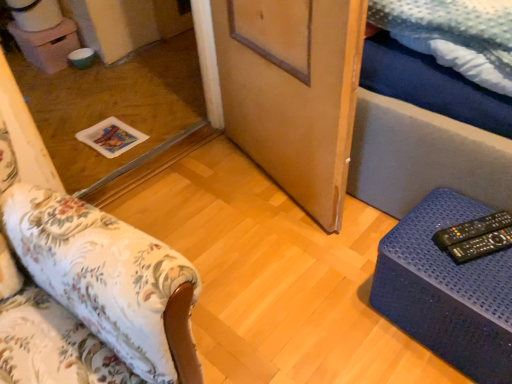
I want to click on floral fabric ottoman at lower left, the 2th furniture in the right-to-left sequence, so click(106, 281).

Locate an element on the screen. The width and height of the screenshot is (512, 384). wooden door at center is located at coordinates (293, 92).

Describe the element at coordinates (480, 246) in the screenshot. The image size is (512, 384). I see `black plastic remote at lower right, the 2th remote viewed from the back` at that location.

Identify the location of black plastic remote at lower right, which is the 1th remote in front-to-back order. (480, 246).

Find the location of a particular element. floral fabric ottoman at lower left, the 2th furniture in the right-to-left sequence is located at coordinates (106, 281).

Between black plastic remote at lower right, the 2th remote viewed from the back, and floral fabric ottoman at lower left, the 2th furniture in the right-to-left sequence, which one has smaller size?

With smaller size is black plastic remote at lower right, the 2th remote viewed from the back.

Considering the positions of objects black plastic remote at lower right, which is the 1th remote in front-to-back order, and floral fabric ottoman at lower left, which is counted as the first furniture, starting from the left, in the image provided, who is more to the right, black plastic remote at lower right, which is the 1th remote in front-to-back order, or floral fabric ottoman at lower left, which is counted as the first furniture, starting from the left,?

black plastic remote at lower right, which is the 1th remote in front-to-back order.

I want to click on the 2nd remote counting from the right side of the floral fabric ottoman at lower left, the 2th furniture in the right-to-left sequence, so click(x=480, y=246).

In the scene shown: From a real-world perspective, who is located lower, black plastic remote at lower right, the 2th remote viewed from the back, or floral fabric ottoman at lower left, the 2th furniture in the right-to-left sequence?

From a 3D spatial view, black plastic remote at lower right, the 2th remote viewed from the back, is below.

Is transparent glass door at center positioned with its back to wooden door at center?

A: transparent glass door at center does not have its back to wooden door at center.

Considering the relative sizes of transparent glass door at center and wooden door at center in the image provided, is transparent glass door at center shorter than wooden door at center?

Yes, transparent glass door at center is shorter than wooden door at center.

Looking at their sizes, would you say transparent glass door at center is wider or thinner than wooden door at center?

In the image, transparent glass door at center appears to be wider than wooden door at center.

From a real-world perspective, between transparent glass door at center and wooden door at center, who is vertically higher?

wooden door at center is physically above.

Considering the sizes of objects transparent glass door at center and blue textured ottoman at lower right, the first furniture in the right-to-left sequence, in the image provided, who is wider, transparent glass door at center or blue textured ottoman at lower right, the first furniture in the right-to-left sequence,?

transparent glass door at center.

Looking at this image, considering the relative positions of transparent glass door at center and blue textured ottoman at lower right, which is counted as the second furniture, starting from the left, in the image provided, is transparent glass door at center to the right of blue textured ottoman at lower right, which is counted as the second furniture, starting from the left, from the viewer's perspective?

No, transparent glass door at center is not to the right of blue textured ottoman at lower right, which is counted as the second furniture, starting from the left.

Considering the positions of points (153, 53) and (494, 294), is point (153, 53) closer to camera compared to point (494, 294)?

No.

Is blue textured ottoman at lower right, which is counted as the second furniture, starting from the left, inside or outside of transparent glass door at center?

blue textured ottoman at lower right, which is counted as the second furniture, starting from the left, cannot be found inside transparent glass door at center.

Is blue textured ottoman at lower right, which is counted as the second furniture, starting from the left, thinner than transparent glass door at center?

Yes.

From the image's perspective, is blue textured ottoman at lower right, the first furniture in the right-to-left sequence, above or below transparent glass door at center?

From the image's perspective, blue textured ottoman at lower right, the first furniture in the right-to-left sequence, appears below transparent glass door at center.

Which object is thinner, black plastic remote at lower right, which is the 1th remote in front-to-back order, or transparent glass door at center?

black plastic remote at lower right, which is the 1th remote in front-to-back order.

Considering the sizes of objects black plastic remote at lower right, which is the 1th remote in front-to-back order, and transparent glass door at center in the image provided, who is bigger, black plastic remote at lower right, which is the 1th remote in front-to-back order, or transparent glass door at center?

transparent glass door at center.

Does black plastic remote at lower right, the 2th remote viewed from the back, turn towards transparent glass door at center?

No, black plastic remote at lower right, the 2th remote viewed from the back, is not aimed at transparent glass door at center.

Relative to wooden door at center, is black plastic remote at lower right, the 2th remote viewed from the back, in front or behind?

In the image, black plastic remote at lower right, the 2th remote viewed from the back, appears behind wooden door at center.

Does point (460, 256) come behind point (289, 143)?

No, it is in front of (289, 143).

Identify the location of door that appears on the left of black plastic remote at lower right, which is the 1th remote in front-to-back order. This screenshot has width=512, height=384. (293, 92).

Could you measure the distance between black plastic remote at lower right, which is the 1th remote in front-to-back order, and wooden door at center?

26.90 inches.

From the picture: From a real-world perspective, is black plastic remote at lower right, the 2th remote viewed from the back, above or below blue textured ottoman at lower right, which is counted as the second furniture, starting from the left?

black plastic remote at lower right, the 2th remote viewed from the back, is above blue textured ottoman at lower right, which is counted as the second furniture, starting from the left.

You are a GUI agent. You are given a task and a screenshot of the screen. Output one action in this format:
    pyautogui.click(x=<x>, y=<y>)
    Task: Click on the 1st furniture in front of the black plastic remote at lower right, which is the 1th remote in front-to-back order, counting from the anchor's position
    Image resolution: width=512 pixels, height=384 pixels.
    Given the screenshot: What is the action you would take?
    pyautogui.click(x=447, y=290)

What's the angular difference between black plastic remote at lower right, which is the 1th remote in front-to-back order, and blue textured ottoman at lower right, which is counted as the second furniture, starting from the left,'s facing directions?

The angular difference between black plastic remote at lower right, which is the 1th remote in front-to-back order, and blue textured ottoman at lower right, which is counted as the second furniture, starting from the left, is 28.1 degrees.

Can you confirm if black plastic remote at lower right, the 2th remote viewed from the back, is bigger than blue textured ottoman at lower right, the first furniture in the right-to-left sequence?

No.

From the image's perspective, which remote is the 1st one above the floral fabric ottoman at lower left, the 2th furniture in the right-to-left sequence? Please provide its 2D coordinates.

[(480, 246)]

This screenshot has width=512, height=384. In order to click on door to the right of transparent glass door at center in this screenshot , I will do `click(293, 92)`.

Estimate the real-world distances between objects in this image. Which object is closer to black plastic remote at lower right, which is the 1th remote in front-to-back order, transparent glass door at center or floral fabric ottoman at lower left, which is counted as the first furniture, starting from the left?

Based on the image, floral fabric ottoman at lower left, which is counted as the first furniture, starting from the left, appears to be nearer to black plastic remote at lower right, which is the 1th remote in front-to-back order.

From the image, which object appears to be farther from black plastic remote at lower right, which is counted as the 1th remote, starting from the back, wooden door at center or blue textured ottoman at lower right, which is counted as the second furniture, starting from the left?

Based on the image, wooden door at center appears to be further to black plastic remote at lower right, which is counted as the 1th remote, starting from the back.

Based on their spatial positions, is wooden door at center or black plastic remote at lower right, which is counted as the 1th remote, starting from the back, further from black plastic remote at lower right, the 2th remote viewed from the back?

Among the two, wooden door at center is located further to black plastic remote at lower right, the 2th remote viewed from the back.

From the image, which object appears to be farther from floral fabric ottoman at lower left, the 2th furniture in the right-to-left sequence, blue textured ottoman at lower right, the first furniture in the right-to-left sequence, or black plastic remote at lower right, the second remote in the front-to-back sequence?

Among the two, black plastic remote at lower right, the second remote in the front-to-back sequence, is located further to floral fabric ottoman at lower left, the 2th furniture in the right-to-left sequence.

When comparing their distances from blue textured ottoman at lower right, the first furniture in the right-to-left sequence, does black plastic remote at lower right, the second remote in the front-to-back sequence, or wooden door at center seem further?

The object further to blue textured ottoman at lower right, the first furniture in the right-to-left sequence, is wooden door at center.

From the image, which object appears to be farther from black plastic remote at lower right, the second remote in the front-to-back sequence, blue textured ottoman at lower right, which is counted as the second furniture, starting from the left, or floral fabric ottoman at lower left, which is counted as the first furniture, starting from the left?

The object further to black plastic remote at lower right, the second remote in the front-to-back sequence, is floral fabric ottoman at lower left, which is counted as the first furniture, starting from the left.

Based on the photo, looking at the image, which one is located further to black plastic remote at lower right, which is counted as the 1th remote, starting from the back, floral fabric ottoman at lower left, which is counted as the first furniture, starting from the left, or transparent glass door at center?

Among the two, transparent glass door at center is located further to black plastic remote at lower right, which is counted as the 1th remote, starting from the back.

Estimate the real-world distances between objects in this image. Which object is further from transparent glass door at center, black plastic remote at lower right, which is the 1th remote in front-to-back order, or floral fabric ottoman at lower left, the 2th furniture in the right-to-left sequence?

black plastic remote at lower right, which is the 1th remote in front-to-back order.

You are a GUI agent. You are given a task and a screenshot of the screen. Output one action in this format:
    pyautogui.click(x=<x>, y=<y>)
    Task: Click on the door situated between transparent glass door at center and blue textured ottoman at lower right, which is counted as the second furniture, starting from the left, from left to right
    The height and width of the screenshot is (384, 512).
    Given the screenshot: What is the action you would take?
    pyautogui.click(x=293, y=92)

Find the location of a particular element. The image size is (512, 384). door between floral fabric ottoman at lower left, the 2th furniture in the right-to-left sequence, and black plastic remote at lower right, which is counted as the 1th remote, starting from the back is located at coordinates (293, 92).

In order to click on door located between floral fabric ottoman at lower left, the 2th furniture in the right-to-left sequence, and blue textured ottoman at lower right, the first furniture in the right-to-left sequence, in the left-right direction in this screenshot , I will do `click(293, 92)`.

At what (x,y) coordinates should I click in order to perform the action: click on furniture between floral fabric ottoman at lower left, which is counted as the first furniture, starting from the left, and black plastic remote at lower right, which is counted as the 1th remote, starting from the back, from left to right. Please return your answer as a coordinate pair (x, y). This screenshot has height=384, width=512. Looking at the image, I should click on tap(447, 290).